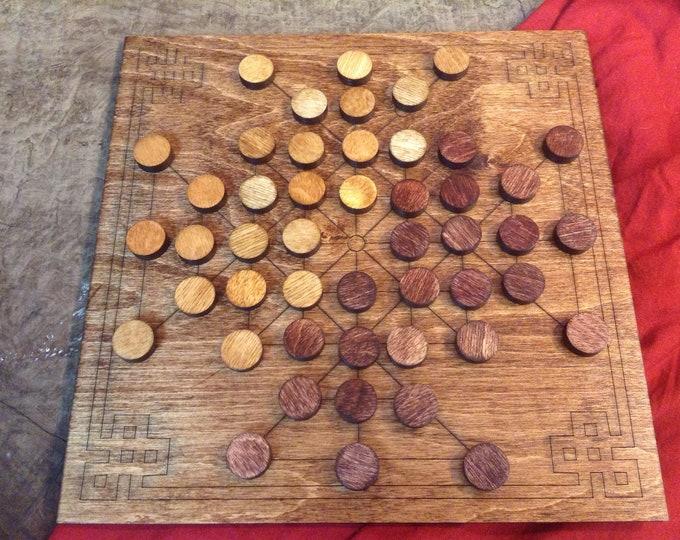
This screenshot has width=680, height=540. I want to click on table, so click(x=54, y=157).